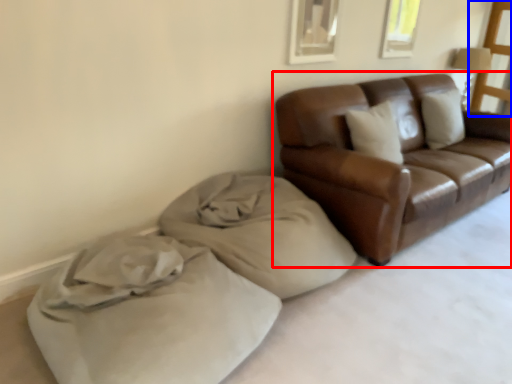
Question: Which object appears farthest to the camera in this image, studio couch (highlighted by a red box) or window screen (highlighted by a blue box)?

Choices:
 (A) studio couch
 (B) window screen

Answer: (B)